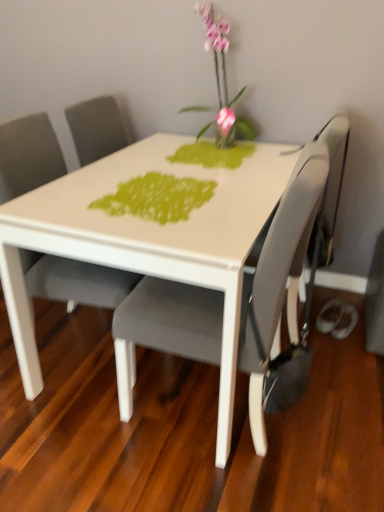
In order to click on free space in front of matte gray chair at center, the first chair in the left-to-right sequence in this screenshot , I will do `click(64, 448)`.